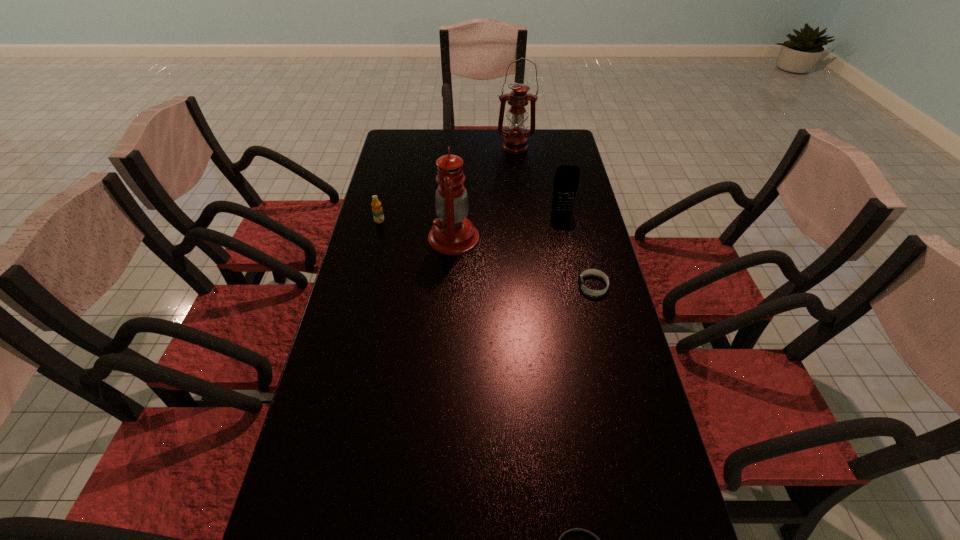
Locate an element on the screen. This screenshot has height=540, width=960. cellular telephone that is at the right edge is located at coordinates (566, 180).

Locate an element on the screen. The width and height of the screenshot is (960, 540). wristband that is at the right edge is located at coordinates (589, 271).

Find the location of a particular element. This screenshot has width=960, height=540. object present at the far right corner is located at coordinates (515, 140).

Image resolution: width=960 pixels, height=540 pixels. In order to click on free region at the far edge of the desktop in this screenshot , I will do `click(459, 130)`.

Image resolution: width=960 pixels, height=540 pixels. I want to click on free space at the left edge of the desktop, so click(402, 237).

This screenshot has height=540, width=960. I want to click on vacant space at the right edge, so click(x=588, y=349).

Where is `vacant area between the second object from left to right and the cellular telephone`? This screenshot has height=540, width=960. vacant area between the second object from left to right and the cellular telephone is located at coordinates (508, 225).

Locate an element on the screen. free space that is in between the nearer oil lamp and the third tallest object is located at coordinates (508, 225).

Where is `empty space that is in between the leftmost object and the taller wristband`? This screenshot has height=540, width=960. empty space that is in between the leftmost object and the taller wristband is located at coordinates (487, 253).

This screenshot has height=540, width=960. I want to click on empty space that is in between the third tallest object and the second shortest object, so click(578, 248).